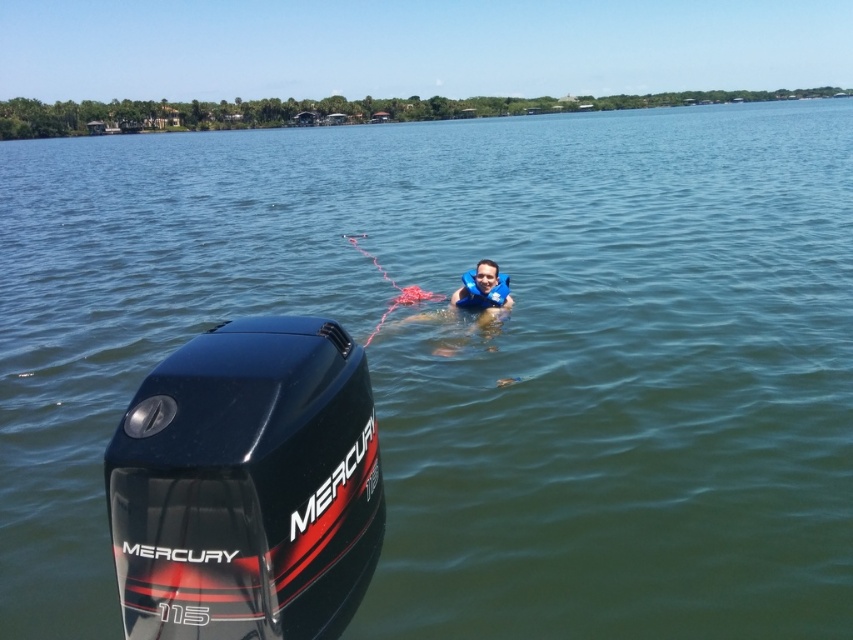
Question: Considering the real-world distances, which object is closest to the shiny black mercury outboard motor at lower left?

Choices:
 (A) blue foam vest at center
 (B) blue foam life jacket at center

Answer: (A)

Question: Can you confirm if blue foam vest at center is positioned to the left of blue foam life jacket at center?

Choices:
 (A) yes
 (B) no

Answer: (B)

Question: Which object is the farthest from the shiny black mercury outboard motor at lower left?

Choices:
 (A) blue foam vest at center
 (B) blue foam life jacket at center

Answer: (B)

Question: Does shiny black mercury outboard motor at lower left have a smaller size compared to blue foam vest at center?

Choices:
 (A) yes
 (B) no

Answer: (B)

Question: Does shiny black mercury outboard motor at lower left appear under blue foam vest at center?

Choices:
 (A) yes
 (B) no

Answer: (A)

Question: Which point is closer to the camera?

Choices:
 (A) blue foam vest at center
 (B) shiny black mercury outboard motor at lower left

Answer: (B)